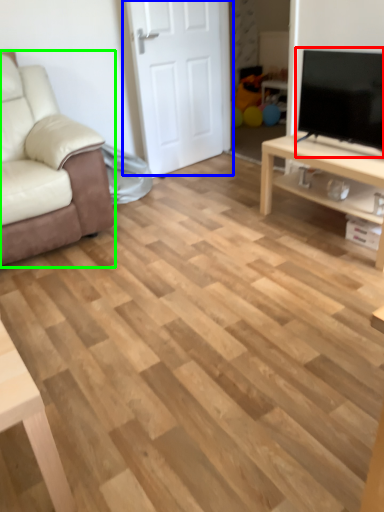
Question: Based on their relative distances, which object is farther from television (highlighted by a red box)? Choose from door (highlighted by a blue box) and chair (highlighted by a green box).

Choices:
 (A) door
 (B) chair

Answer: (B)